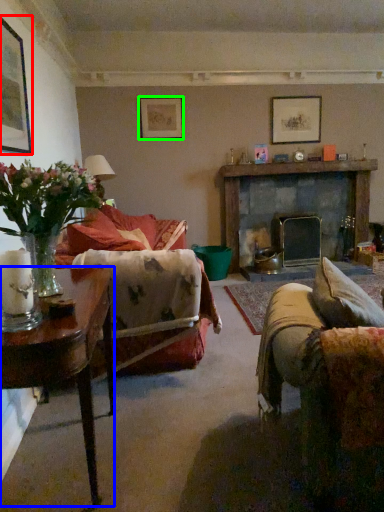
Question: Which object is positioned farthest from picture frame (highlighted by a red box)? Select from table (highlighted by a blue box) and picture frame (highlighted by a green box).

Choices:
 (A) table
 (B) picture frame

Answer: (B)